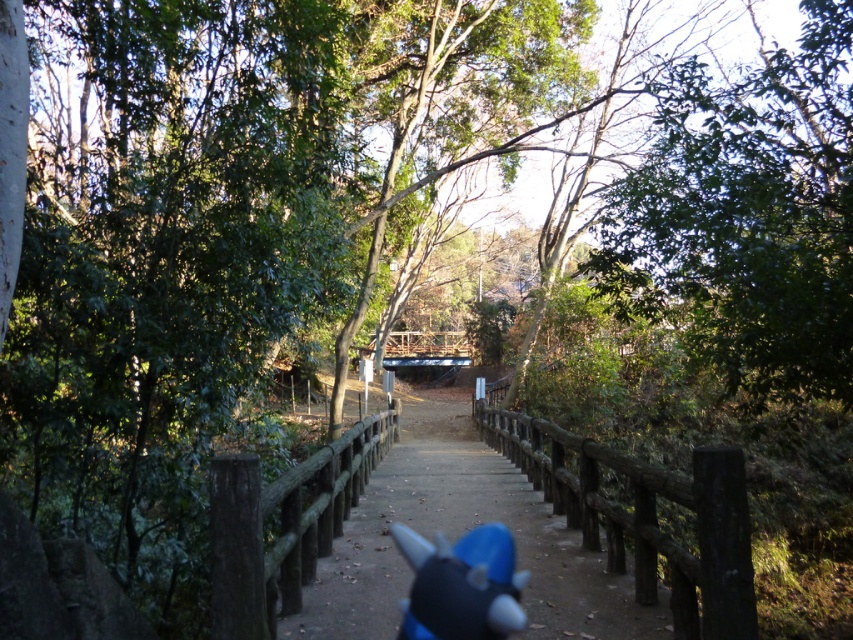
Question: Can you confirm if brown wooden trail at center is positioned below blue plush toy at center?

Choices:
 (A) yes
 (B) no

Answer: (A)

Question: Is the position of brown wooden trail at center more distant than that of blue plush toy at center?

Choices:
 (A) no
 (B) yes

Answer: (B)

Question: Which object appears farthest from the camera in this image?

Choices:
 (A) brown wooden trail at center
 (B) blue plush toy at center

Answer: (A)

Question: Does brown wooden trail at center have a smaller size compared to blue plush toy at center?

Choices:
 (A) no
 (B) yes

Answer: (A)

Question: Which point appears closest to the camera in this image?

Choices:
 (A) (412, 513)
 (B) (479, 541)

Answer: (B)

Question: Among these points, which one is farthest from the camera?

Choices:
 (A) (421, 550)
 (B) (480, 515)

Answer: (B)